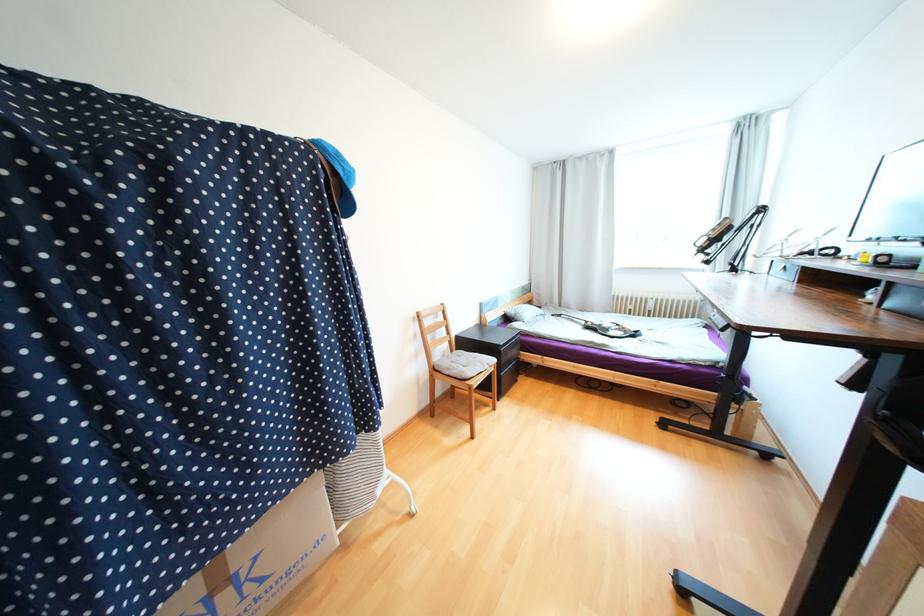
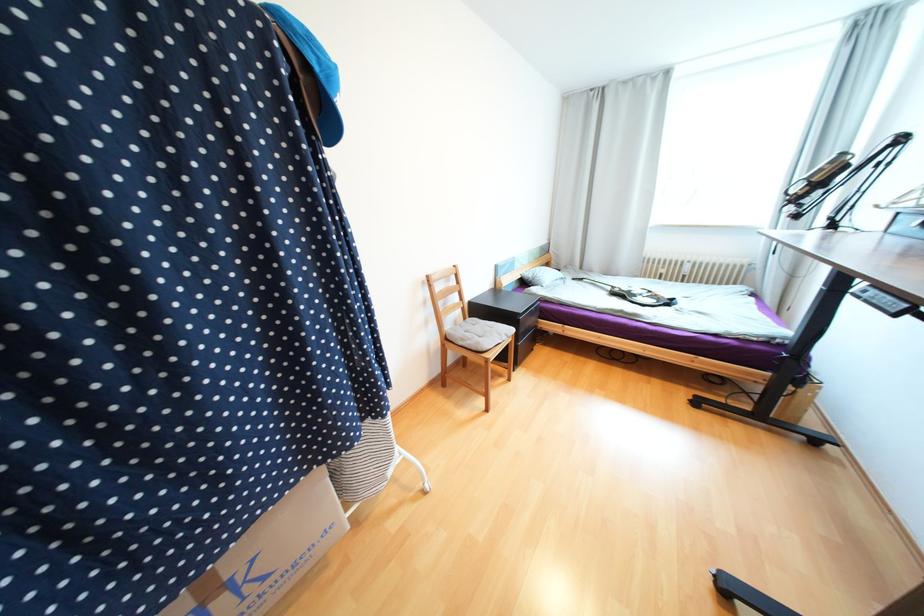
Locate, in the second image, the point that corresponds to (488,363) in the first image.

(505, 334)